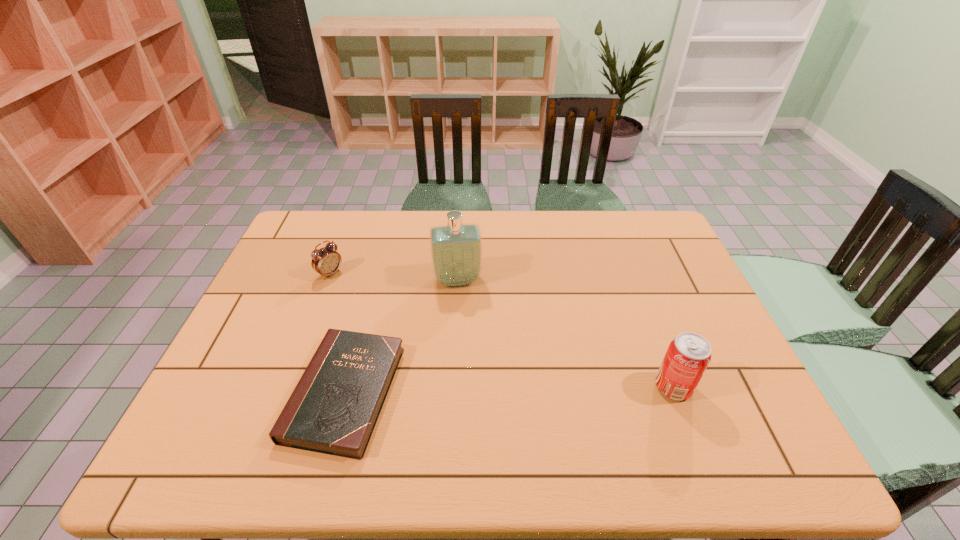
This screenshot has width=960, height=540. Identify the location of Bible. (333, 409).

Where is `the second tallest object`? the second tallest object is located at coordinates (688, 355).

At what (x,y) coordinates should I click in order to perform the action: click on soda can. Please return your answer as a coordinate pair (x, y). The image size is (960, 540). Looking at the image, I should click on (688, 355).

Where is `the tallest object`? Image resolution: width=960 pixels, height=540 pixels. the tallest object is located at coordinates (456, 249).

You are a GUI agent. You are given a task and a screenshot of the screen. Output one action in this format:
    pyautogui.click(x=<x>, y=<y>)
    Task: Click on the third object from left to right
    The width and height of the screenshot is (960, 540).
    Given the screenshot: What is the action you would take?
    pyautogui.click(x=456, y=249)

Find the location of a particular element. The image size is (960, 540). the second shortest object is located at coordinates (326, 261).

You are a GUI agent. You are given a task and a screenshot of the screen. Output one action in this format:
    pyautogui.click(x=<x>, y=<y>)
    Task: Click on the vacant region located 0.340m on the right of the shortest object
    The width and height of the screenshot is (960, 540).
    Given the screenshot: What is the action you would take?
    pyautogui.click(x=540, y=393)

Where is `free space located on the back of the rightmost object`? This screenshot has height=540, width=960. free space located on the back of the rightmost object is located at coordinates (638, 296).

You are a GUI agent. You are given a task and a screenshot of the screen. Output one action in this format:
    pyautogui.click(x=<x>, y=<y>)
    Task: Click on the vacant point located 0.280m on the front label of the second object from right to left
    
    Given the screenshot: What is the action you would take?
    pyautogui.click(x=471, y=368)

Identify the location of vacant space located 0.100m on the front label of the second object from right to left. The image size is (960, 540). (464, 316).